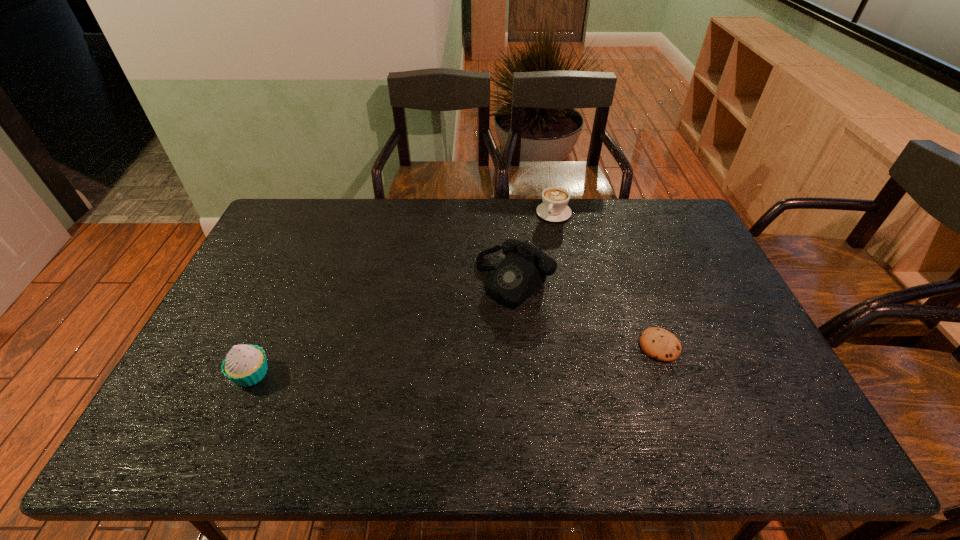
The image size is (960, 540). In order to click on vacant space located 0.350m on the dial of the second farthest object in this screenshot , I will do `click(403, 383)`.

Identify the location of free space located to the right of the third tallest object's handle. Image resolution: width=960 pixels, height=540 pixels. (516, 294).

Image resolution: width=960 pixels, height=540 pixels. I want to click on free space located 0.280m to the right of the third tallest object's handle, so click(x=525, y=273).

Where is `blank area located 0.310m to the right of the third tallest object's handle`? This screenshot has height=540, width=960. blank area located 0.310m to the right of the third tallest object's handle is located at coordinates (522, 279).

Where is `object that is positioned at the far edge`? The width and height of the screenshot is (960, 540). object that is positioned at the far edge is located at coordinates (554, 208).

The width and height of the screenshot is (960, 540). I want to click on object positioned at the near edge, so click(x=245, y=365).

Locate an element on the screen. object located in the left edge section of the desktop is located at coordinates (245, 365).

This screenshot has height=540, width=960. In order to click on object present at the near left corner in this screenshot , I will do `click(245, 365)`.

Find the location of a particular element. The image size is (960, 540). vacant region at the far edge of the desktop is located at coordinates (395, 222).

Identify the location of free space at the near edge of the desktop. The image size is (960, 540). (328, 402).